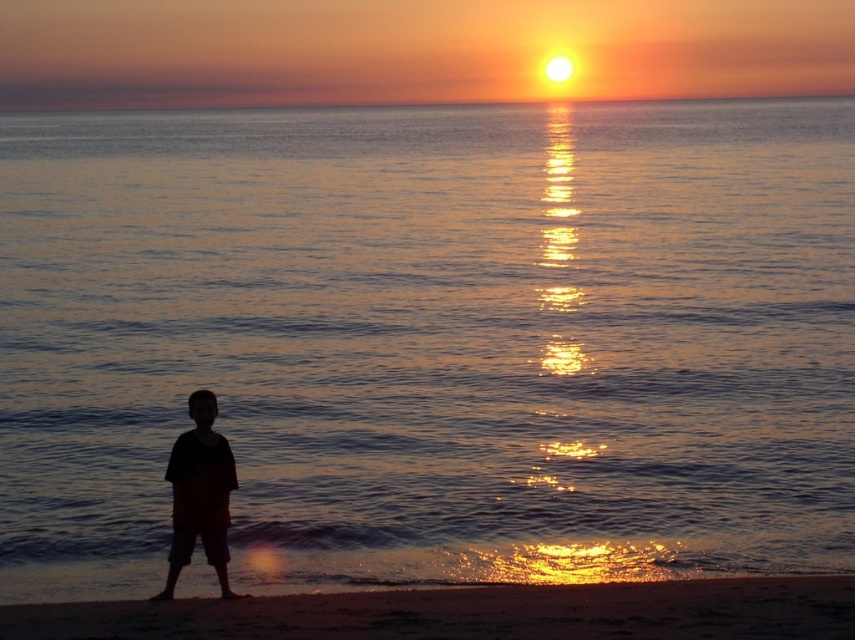
Question: Can you confirm if sandy beach at lower center is smaller than silhouette fabric shorts at lower left?

Choices:
 (A) yes
 (B) no

Answer: (B)

Question: Does sandy beach at lower center appear on the right side of silhouette fabric shorts at lower left?

Choices:
 (A) yes
 (B) no

Answer: (A)

Question: Which of the following is the closest to the observer?

Choices:
 (A) silhouette fabric shorts at lower left
 (B) sandy beach at lower center

Answer: (B)

Question: Which point appears closest to the camera in this image?

Choices:
 (A) (717, 609)
 (B) (190, 554)

Answer: (A)

Question: Is sandy beach at lower center smaller than silhouette fabric shorts at lower left?

Choices:
 (A) no
 (B) yes

Answer: (A)